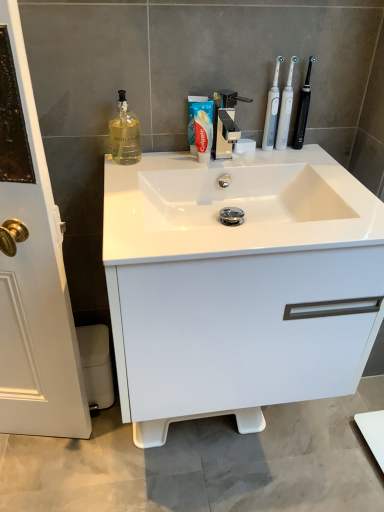
The image size is (384, 512). Find the location of `vacant space in front of white plastic toothbrush at upper center, the first toothbrush in the left-to-right sequence`. vacant space in front of white plastic toothbrush at upper center, the first toothbrush in the left-to-right sequence is located at coordinates (284, 167).